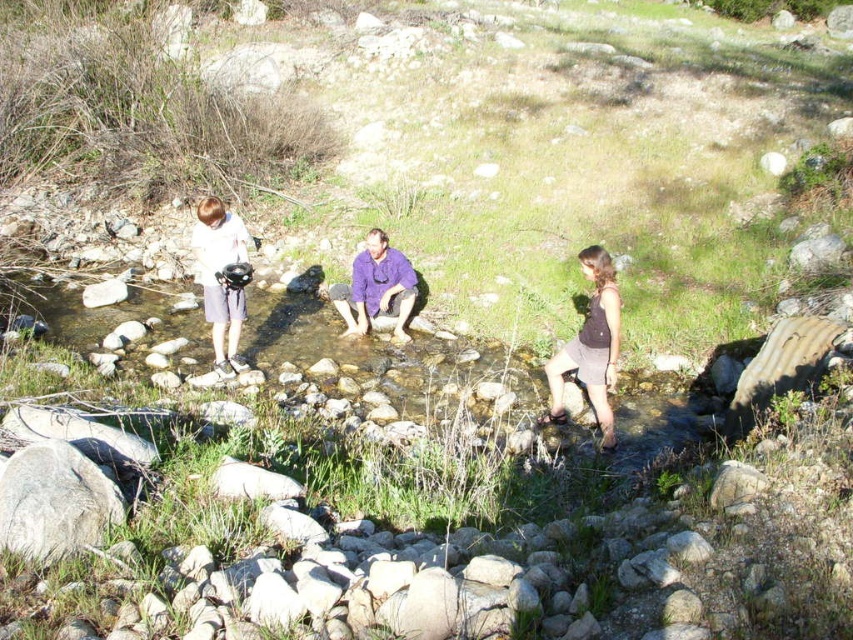
You are a hiker trying to decide whether to cross the stream. You notice the matte black helmet at left and the purple cotton shirt at center. Which item is bigger and might be easier to use as a stepping stone?

The matte black helmet at left is larger in size than the purple cotton shirt at center, so it might be easier to use as a stepping stone.

You are standing at the edge of the stream and see two points marked in the scene. Which point, point (589, 365) or point (236, 300), is closer to you?

Point (589, 365) is closer to the viewer than point (236, 300).

You are standing at the edge of the stream and want to take a photo of both the dark gray fabric skirt at center and the matte black helmet at left. Which object should you focus on first to ensure both are in the frame?

You should focus on the dark gray fabric skirt at center first because it is in front of the matte black helmet at left, so positioning the camera to include the foreground object will naturally include the background one as well.